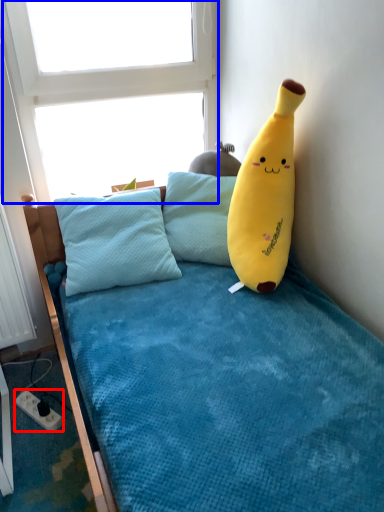
Question: Which point is closer to the camera, power outlet (highlighted by a red box) or window screen (highlighted by a blue box)?

Choices:
 (A) power outlet
 (B) window screen

Answer: (B)